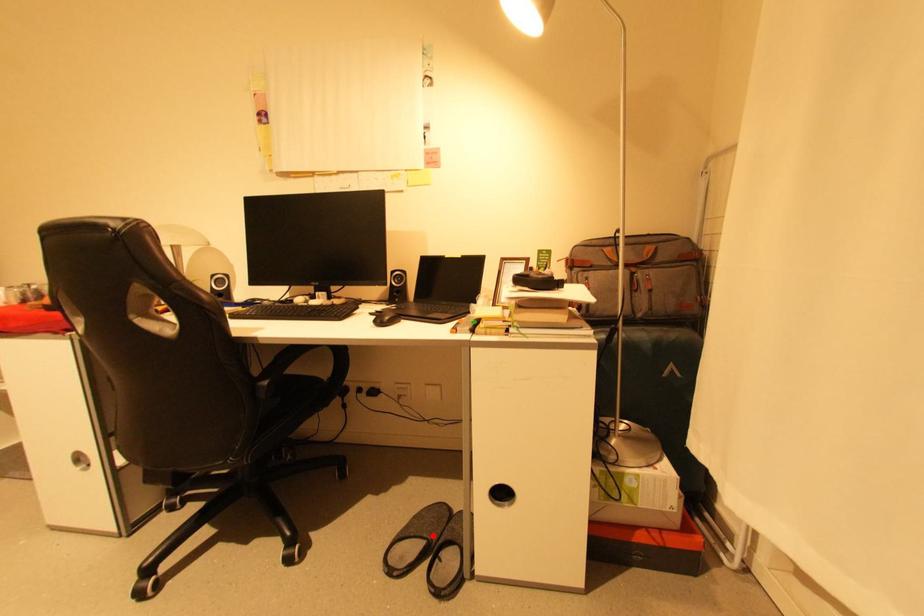
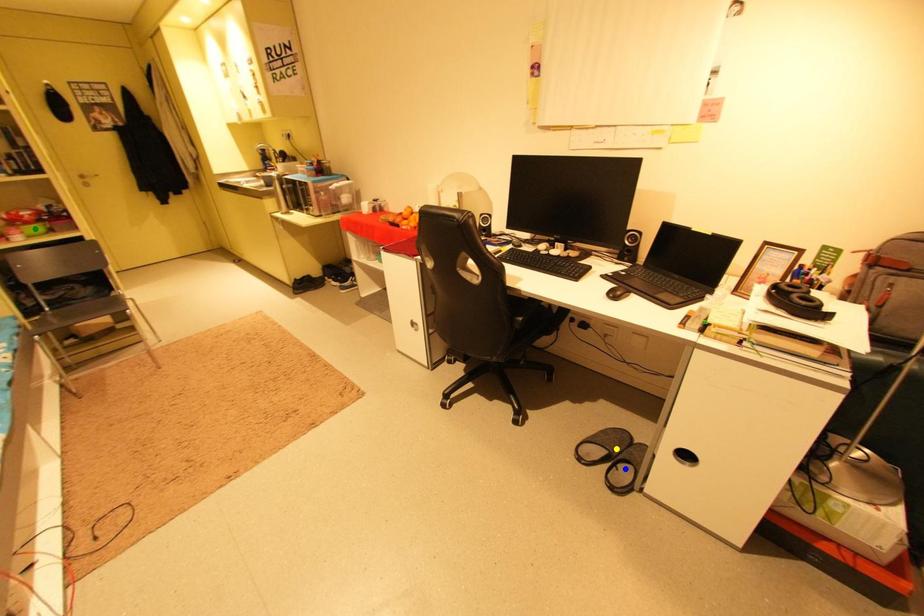
Question: I am providing you with two images of the same scene from different viewpoints. A red point is marked on the first image. You are given multiple points on the second image. Which spot in image 2 lines up with the point in image 1?

Choices:
 (A) green point
 (B) blue point
 (C) yellow point

Answer: (C)